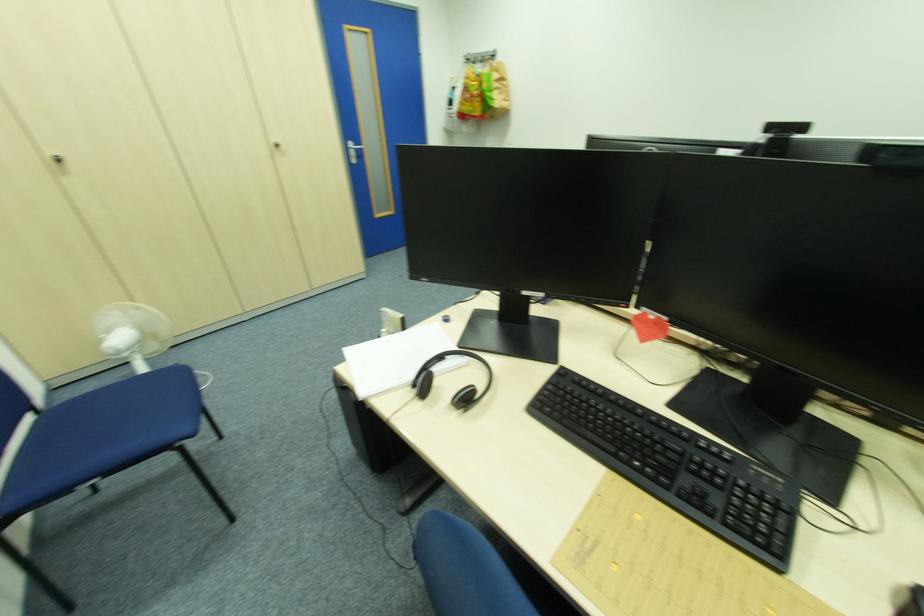
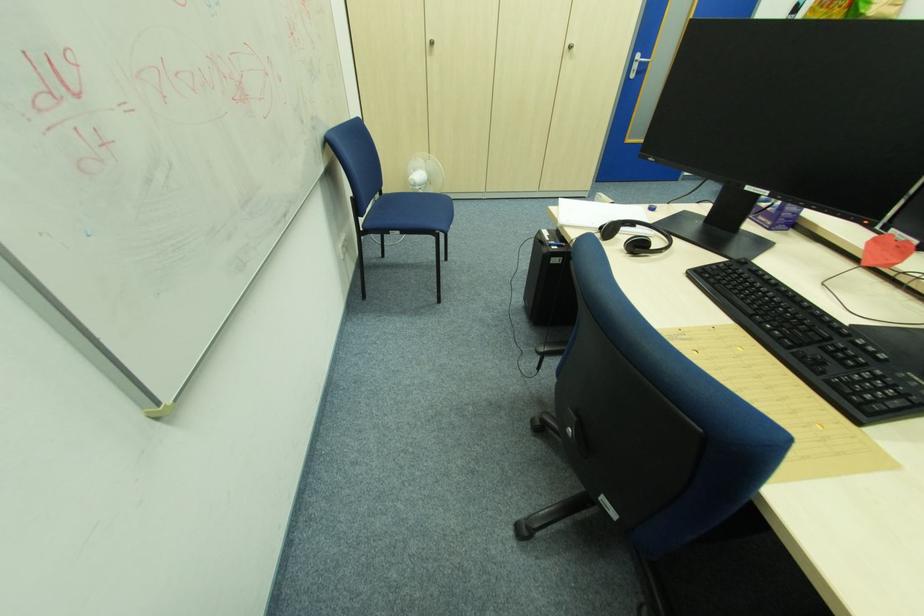
Question: The first image is from the beginning of the video and the second image is from the end. How did the camera likely rotate when shooting the video?

Choices:
 (A) Left
 (B) Right
 (C) Up
 (D) Down

Answer: (A)